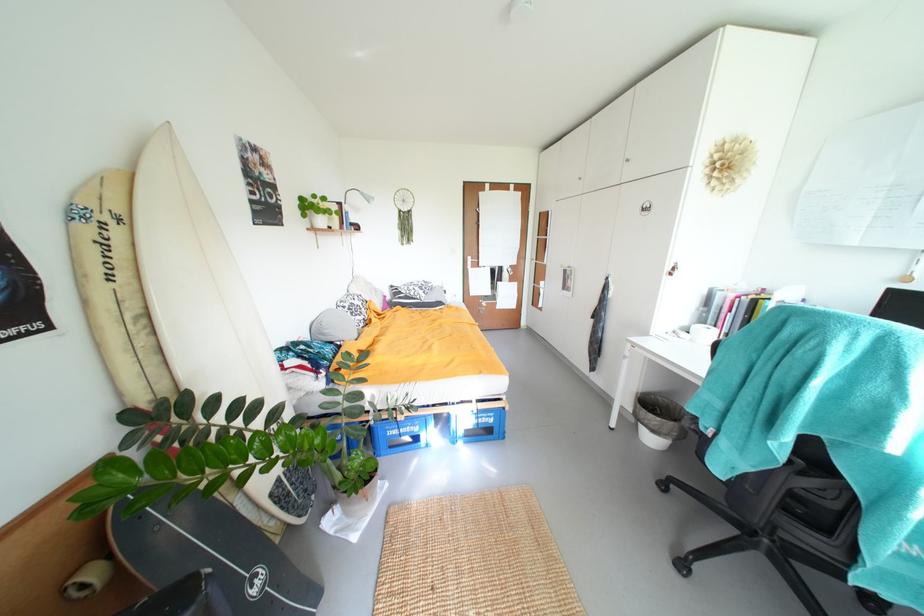
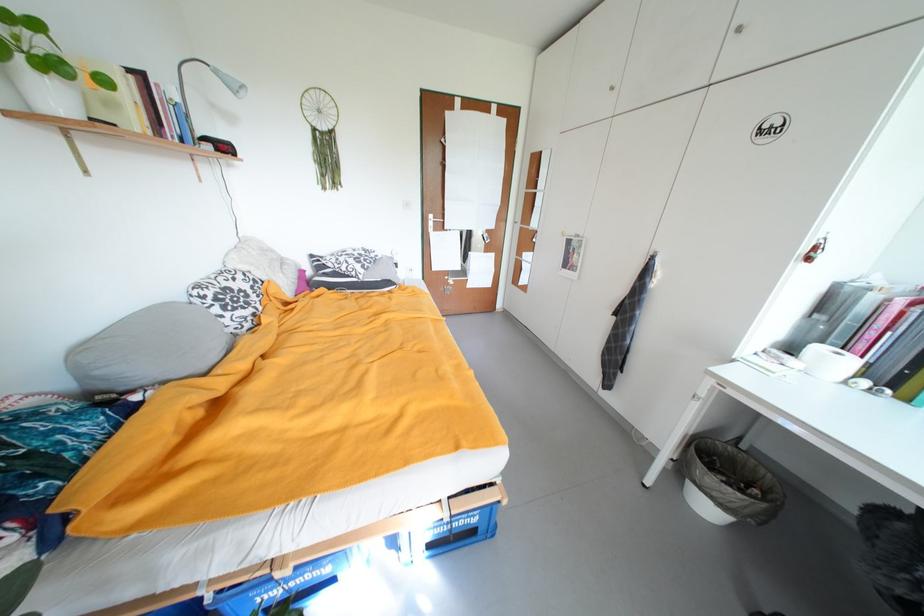
Where in the second image is the point corresponding to point 322,198 from the first image?

(15, 18)